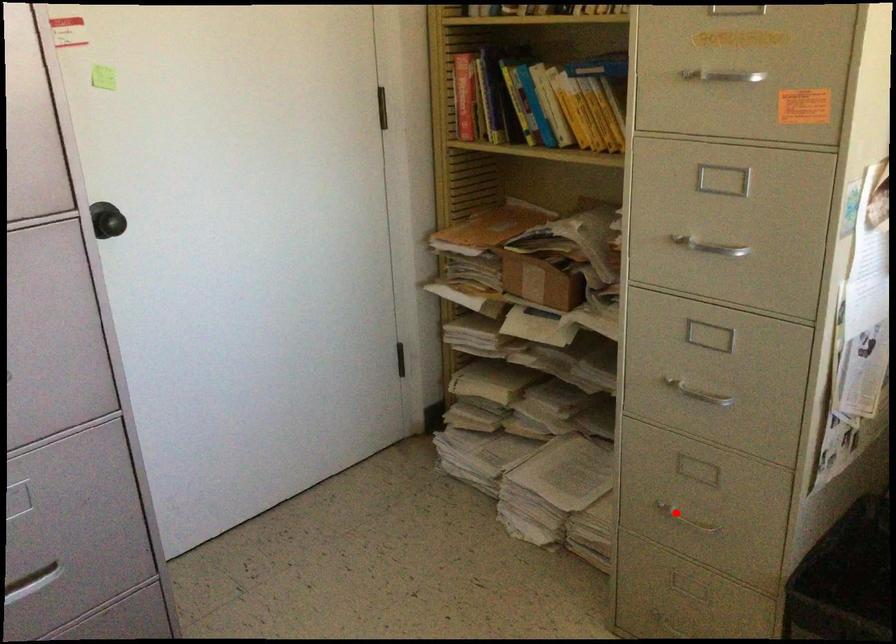
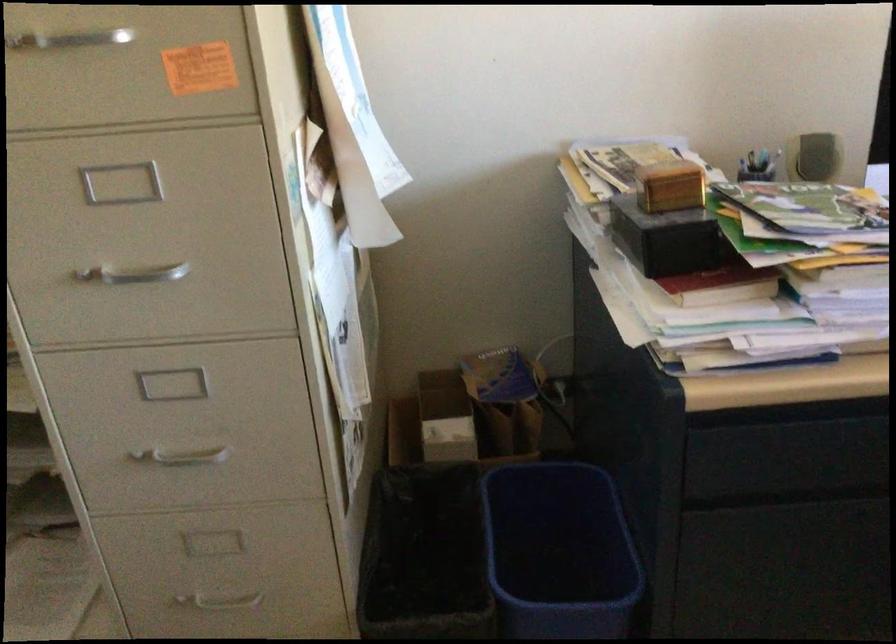
In the second image, find the point that corresponds to the highlighted location in the first image.

(216, 601)